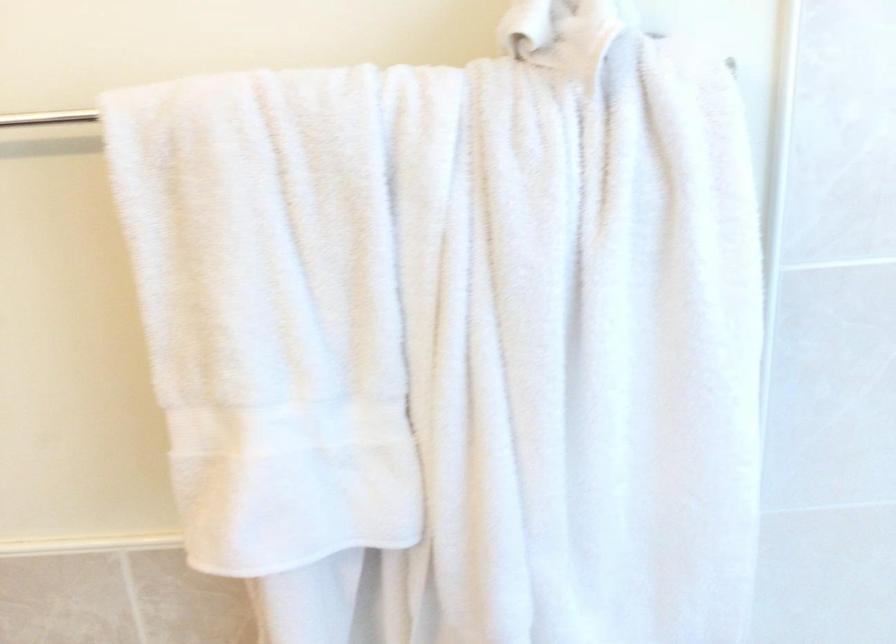
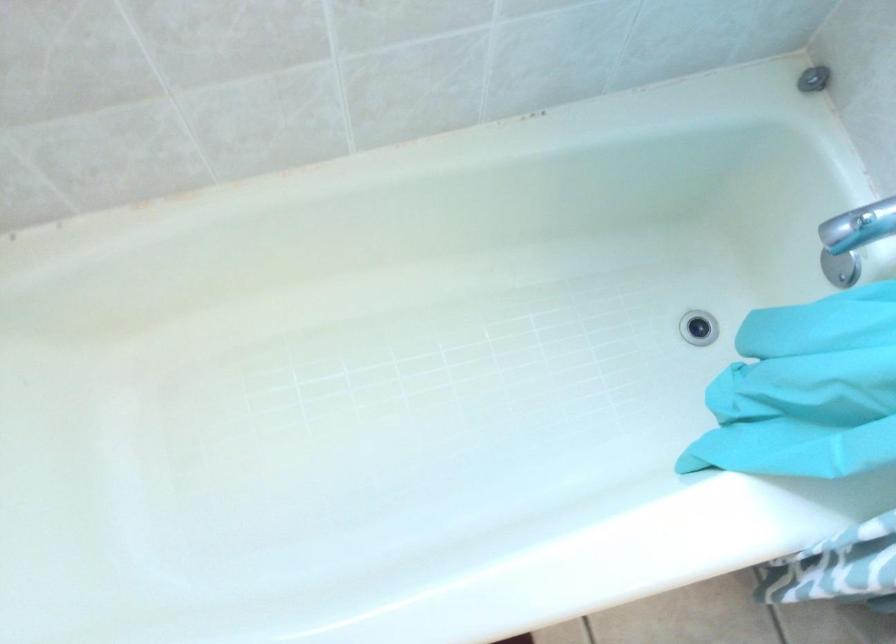
How did the camera likely rotate?

The rotation direction of the camera is right-down.